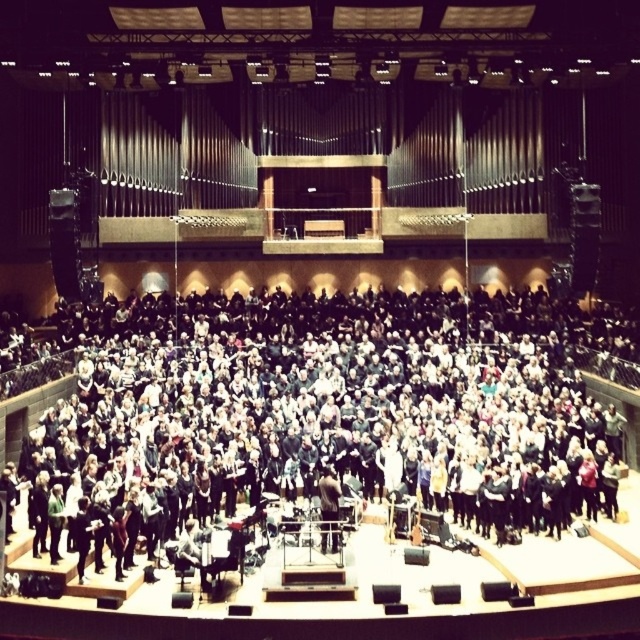
You are a photographer positioned at the back of the concert hall. You want to capture a clear photo of the dark brown leather jacket at center without the black fabric at center blocking it. What should you do?

Answer: The black fabric at center is in front of the dark brown leather jacket at center, so you should move to a position where you can angle your camera above or around the black fabric at center to get an unobstructed view of the dark brown leather jacket at center.

You are a photographer positioned at the back of the concert hall. You need to capture a clear photo of both the black fabric at center and the dark brown leather jacket at center. Which object will appear larger in your photo?

The black fabric at center will appear larger in the photo because it has a larger size compared to the dark brown leather jacket at center.

In the scene shown: You are a photographer positioned at the back of the concert hall. You notice two items at the center of the stage area. One is the black fabric at center and the other is the dark brown leather jacket at center. Which item is closer to the ceiling?

The black fabric at center is located above the dark brown leather jacket at center, so it is closer to the ceiling.